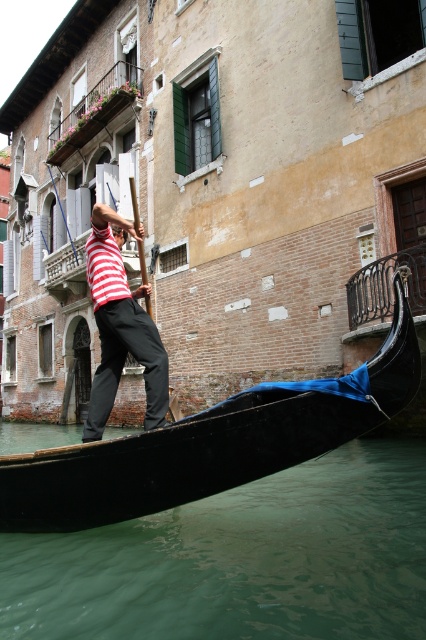
Measure the distance between point [258,632] and camera.

A distance of 5.17 meters exists between point [258,632] and camera.

Between green translucent water at lower center and striped fabric shirt at center, which one appears on the right side from the viewer's perspective?

From the viewer's perspective, green translucent water at lower center appears more on the right side.

Is point (242, 532) more distant than point (115, 378)?

No, (242, 532) is in front of (115, 378).

Locate an element on the screen. green translucent water at lower center is located at coordinates click(x=241, y=561).

Does black polished gondola at center have a larger size compared to striped fabric shirt at center?

Actually, black polished gondola at center might be smaller than striped fabric shirt at center.

Is point (351, 420) positioned before point (115, 301)?

Yes, it is.

Image resolution: width=426 pixels, height=640 pixels. In order to click on black polished gondola at center in this screenshot , I will do `click(210, 444)`.

Is green translucent water at lower center below black polished gondola at center?

Indeed, green translucent water at lower center is positioned under black polished gondola at center.

From the picture: Is green translucent water at lower center to the right of black polished gondola at center from the viewer's perspective?

No, green translucent water at lower center is not to the right of black polished gondola at center.

Which is behind, point (91, 624) or point (40, 484)?

Point (40, 484)

I want to click on green translucent water at lower center, so click(241, 561).